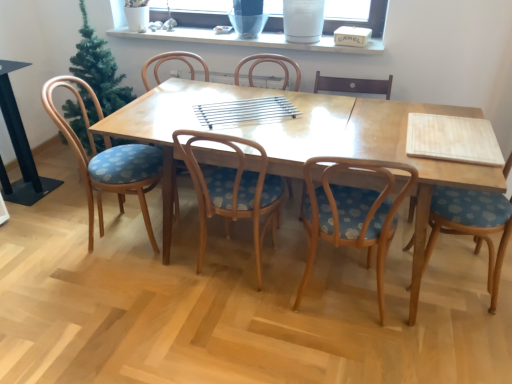
Identify the location of free spot in front of wooden chair with blue floral cushion at center, positioned as the second chair in right-to-left order. (357, 362).